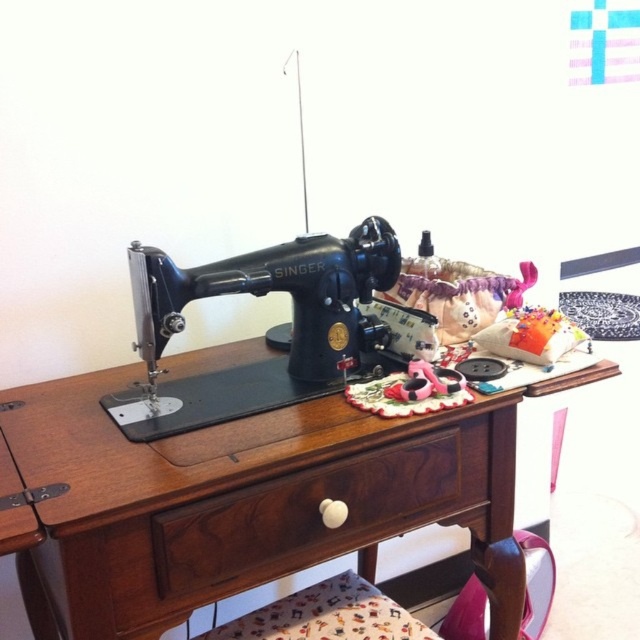
Question: Does wooden sewing machine at center appear under brown wood drawer at center?

Choices:
 (A) no
 (B) yes

Answer: (A)

Question: Estimate the real-world distances between objects in this image. Which object is farther from the black metal sewing machine at center?

Choices:
 (A) brown wood drawer at center
 (B) wooden sewing machine at center

Answer: (A)

Question: Can you confirm if wooden sewing machine at center is thinner than black metal sewing machine at center?

Choices:
 (A) yes
 (B) no

Answer: (B)

Question: Which object is farther from the camera taking this photo?

Choices:
 (A) brown wood drawer at center
 (B) wooden sewing machine at center
 (C) black metal sewing machine at center

Answer: (C)

Question: Does black metal sewing machine at center come behind brown wood drawer at center?

Choices:
 (A) no
 (B) yes

Answer: (B)

Question: Based on their relative distances, which object is nearer to the black metal sewing machine at center?

Choices:
 (A) brown wood drawer at center
 (B) wooden sewing machine at center

Answer: (B)